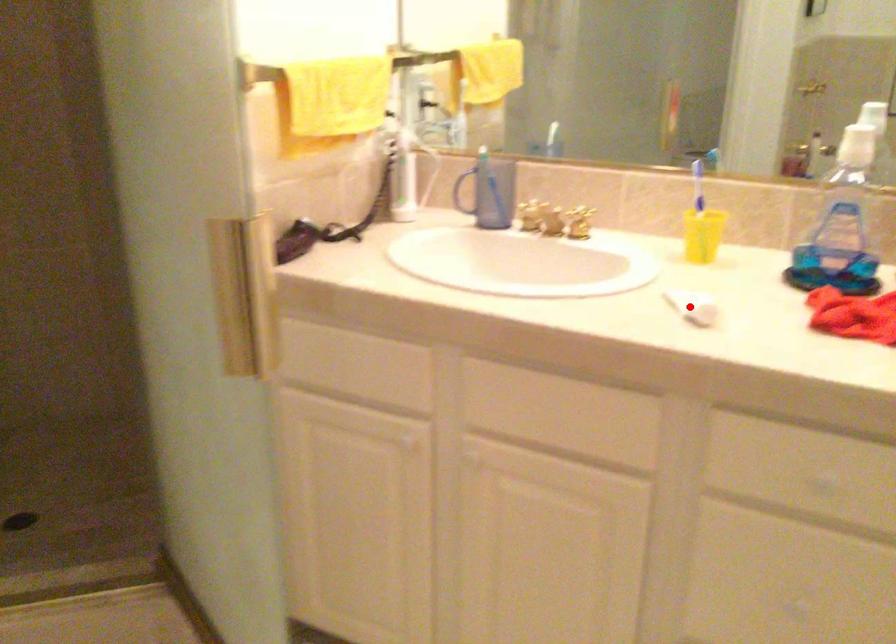
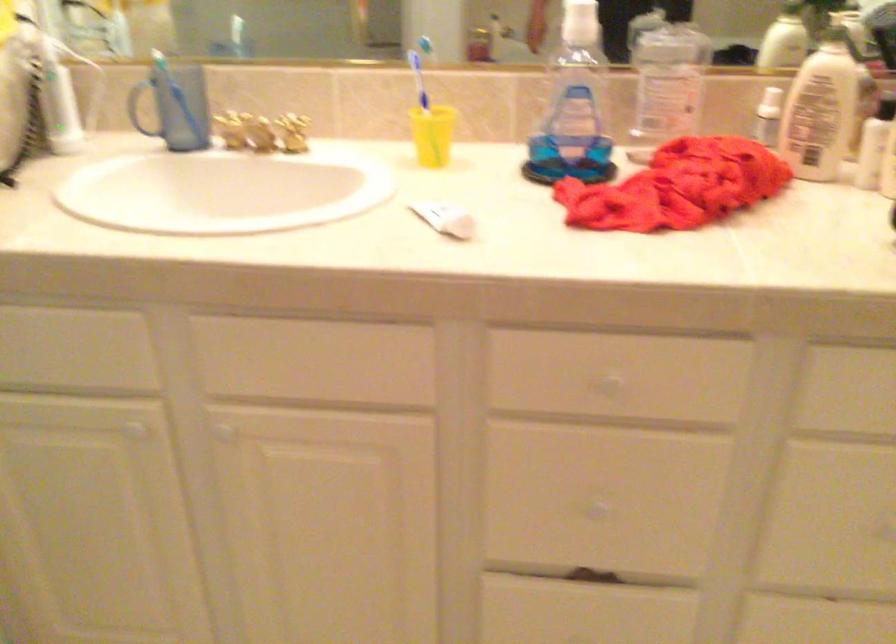
Question: I am providing you with two images of the same scene from different viewpoints. A red point is shown in image1. For the corresponding object point in image2, is it positioned nearer or farther from the camera?

Choices:
 (A) Nearer
 (B) Farther

Answer: (A)